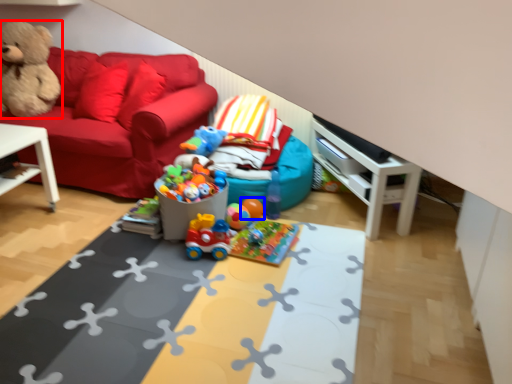
Question: Among these objects, which one is farthest to the camera, teddy bear (highlighted by a red box) or toy (highlighted by a blue box)?

Choices:
 (A) teddy bear
 (B) toy

Answer: (A)